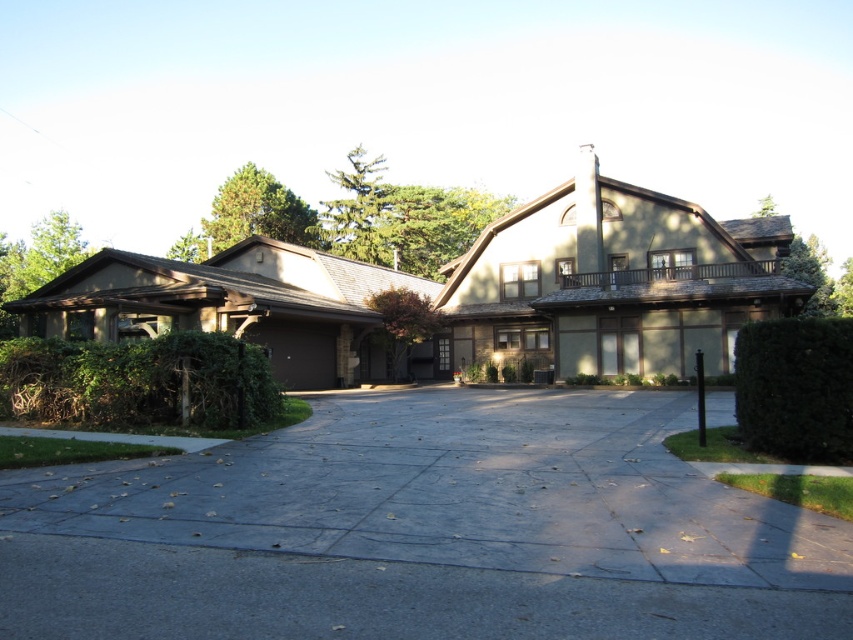
Question: Among these points, which one is nearest to the camera?

Choices:
 (A) (54, 518)
 (B) (804, 330)
 (C) (136, 380)

Answer: (A)

Question: Observing the image, what is the correct spatial positioning of green leafy hedge at lower left in reference to green leafy hedge at right?

Choices:
 (A) below
 (B) above

Answer: (A)

Question: Among these objects, which one is nearest to the camera?

Choices:
 (A) green leafy hedge at right
 (B) green leafy hedge at lower left

Answer: (A)

Question: Is green leafy hedge at lower left positioned at the back of green leafy hedge at right?

Choices:
 (A) yes
 (B) no

Answer: (A)

Question: Among these points, which one is nearest to the camera?

Choices:
 (A) (227, 424)
 (B) (807, 420)
 (C) (233, 461)

Answer: (B)

Question: Is gray concrete driveway at center further to camera compared to green leafy hedge at right?

Choices:
 (A) no
 (B) yes

Answer: (A)